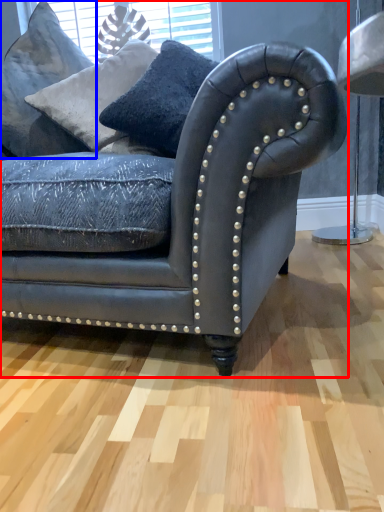
Question: Among these objects, which one is nearest to the camera, studio couch (highlighted by a red box) or pillow (highlighted by a blue box)?

Choices:
 (A) studio couch
 (B) pillow

Answer: (A)